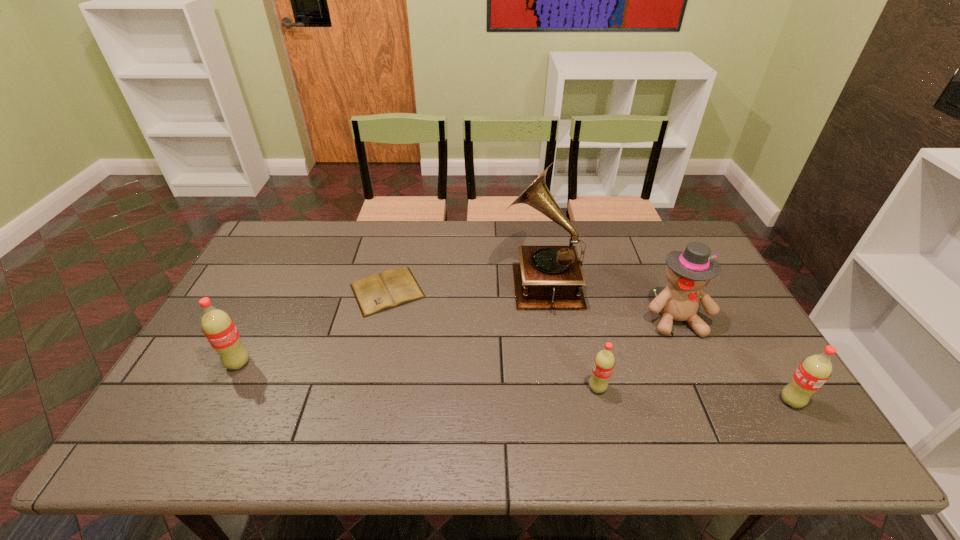
What are the coordinates of `blank area located on the right of the third nearest object` in the screenshot? It's located at (339, 363).

Locate an element on the screen. This screenshot has width=960, height=540. vacant region located 0.400m on the back of the second shortest object is located at coordinates (571, 276).

The image size is (960, 540). I want to click on vacant space located 0.200m on the back of the third shortest object, so click(748, 330).

Identify the location of free location located 0.070m on the horn of the record player. This screenshot has height=540, width=960. (480, 282).

Locate an element on the screen. free location located 0.070m on the horn of the record player is located at coordinates (480, 282).

This screenshot has height=540, width=960. What are the coordinates of `free space located 0.120m on the horn of the record player` in the screenshot? It's located at (464, 282).

You are a GUI agent. You are given a task and a screenshot of the screen. Output one action in this format:
    pyautogui.click(x=<x>, y=<y>)
    Task: Click on the free spot located 0.110m on the back of the shortest object
    
    Given the screenshot: What is the action you would take?
    pyautogui.click(x=397, y=247)

Locate an element on the screen. The height and width of the screenshot is (540, 960). free space located 0.150m on the front-facing side of the rag_doll is located at coordinates (706, 385).

What are the coordinates of `object present at the far edge` in the screenshot? It's located at (548, 277).

Find the location of `object located at the left edge`. object located at the left edge is located at coordinates (218, 327).